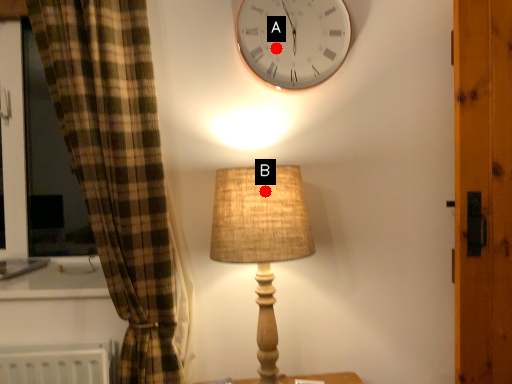
Question: Two points are circled on the image, labeled by A and B beside each circle. Which point is farther to the camera?

Choices:
 (A) A is further
 (B) B is further

Answer: (A)